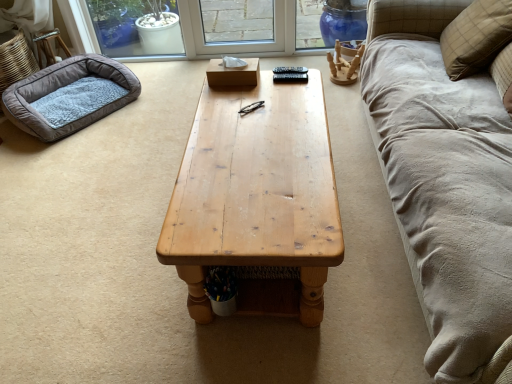
The image size is (512, 384). Identify the location of free point to the right of soft gray fleece dog bed at left. (158, 107).